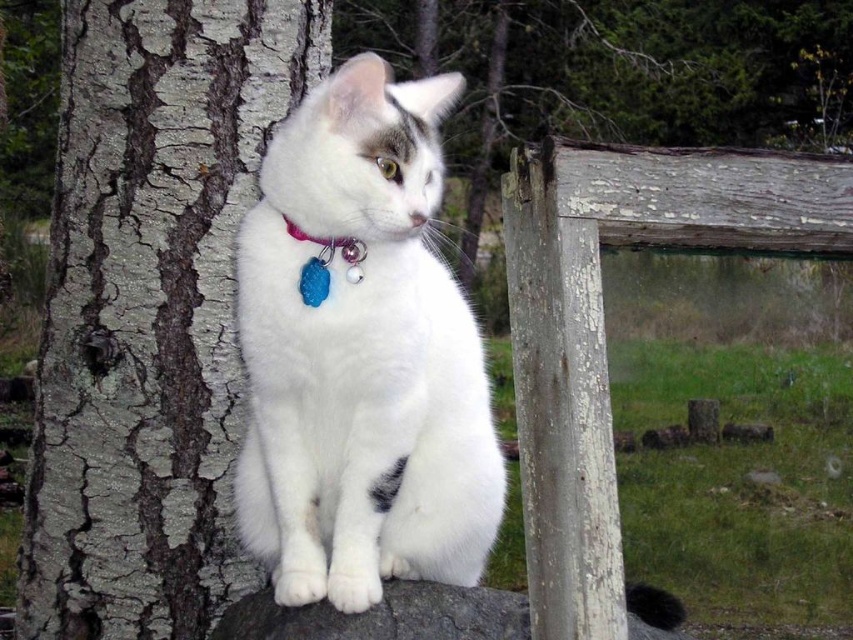
You are a photographer trying to capture the gray rough bark tree trunk at left and the purple fabric collar at center in the same frame. Which object should you focus on first if you want to ensure both are in focus without adjusting the camera settings?

The gray rough bark tree trunk at left is taller than the purple fabric collar at center, so focusing on the tree trunk first would help ensure both are in focus as it is farther away and requires a deeper depth of field.

You are a photographer trying to capture the white fluffy cat at center and its purple fabric collar at center in a closeup shot. Since you want to focus on the collar, should you adjust your camera to zoom in or out?

The white fluffy cat at center has a larger size compared to purple fabric collar at center, so to focus on the collar, you should zoom in to make the collar appear bigger in the frame.

You are a bird flying over the garden and want to land on the closest object between the gray rough bark tree trunk at left and the purple fabric collar at center. Which object should you choose?

The gray rough bark tree trunk at left is located below the purple fabric collar at center, so it is closer to the ground. Since you are flying over, the tree trunk at left is lower and thus closer in vertical distance, making it the better landing spot.